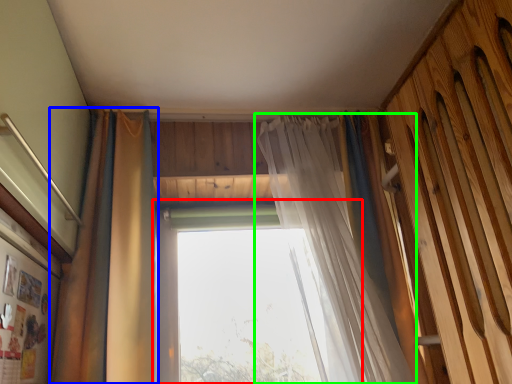
Question: Which object is positioned farthest from window (highlighted by a red box)? Select from curtain (highlighted by a blue box) and curtain (highlighted by a green box).

Choices:
 (A) curtain
 (B) curtain

Answer: (A)